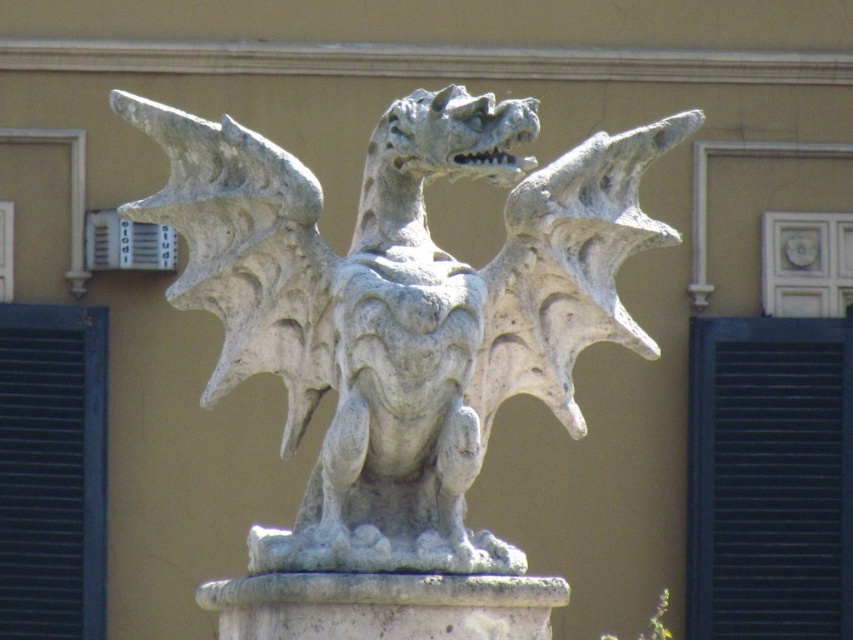
Is black matte shutter at right below blue painted wood shutter at left?

Correct, black matte shutter at right is located below blue painted wood shutter at left.

Does black matte shutter at right have a larger size compared to blue painted wood shutter at left?

Indeed, black matte shutter at right has a larger size compared to blue painted wood shutter at left.

Which is in front, point (737, 541) or point (32, 614)?

Positioned in front is point (32, 614).

This screenshot has width=853, height=640. Find the location of `black matte shutter at right`. black matte shutter at right is located at coordinates (769, 477).

Between gray stone dragon at center and black matte shutter at right, which one appears on the right side from the viewer's perspective?

black matte shutter at right

What do you see at coordinates (402, 308) in the screenshot? The width and height of the screenshot is (853, 640). I see `gray stone dragon at center` at bounding box center [402, 308].

Identify the location of gray stone dragon at center. Image resolution: width=853 pixels, height=640 pixels. (402, 308).

Is gray stone dragon at center further to the viewer compared to blue painted wood shutter at left?

No, it is not.

Which is behind, point (485, 381) or point (16, 509)?

Point (16, 509)

I want to click on gray stone dragon at center, so click(x=402, y=308).